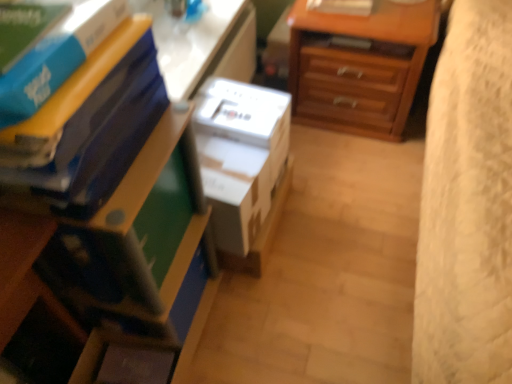
Question: Is white plastic table at upper center further to camera compared to wooden chest of drawers at upper right?

Choices:
 (A) no
 (B) yes

Answer: (A)

Question: Considering the relative positions of white plastic table at upper center and wooden chest of drawers at upper right in the image provided, is white plastic table at upper center to the left of wooden chest of drawers at upper right from the viewer's perspective?

Choices:
 (A) no
 (B) yes

Answer: (B)

Question: Does white plastic table at upper center have a larger size compared to wooden chest of drawers at upper right?

Choices:
 (A) yes
 (B) no

Answer: (B)

Question: Considering the relative sizes of white plastic table at upper center and wooden chest of drawers at upper right in the image provided, is white plastic table at upper center shorter than wooden chest of drawers at upper right?

Choices:
 (A) no
 (B) yes

Answer: (B)

Question: Is white plastic table at upper center to the right of wooden chest of drawers at upper right from the viewer's perspective?

Choices:
 (A) yes
 (B) no

Answer: (B)

Question: From the image's perspective, is white plastic table at upper center above wooden chest of drawers at upper right?

Choices:
 (A) yes
 (B) no

Answer: (B)

Question: Is white plastic table at upper center positioned in front of blue matte book at upper left, the 1th paperback book in the front-to-back sequence?

Choices:
 (A) yes
 (B) no

Answer: (B)

Question: Is white plastic table at upper center far away from blue matte book at upper left, the 1th paperback book in the front-to-back sequence?

Choices:
 (A) no
 (B) yes

Answer: (A)

Question: Considering the relative sizes of white plastic table at upper center and blue matte book at upper left, the 1th paperback book in the front-to-back sequence, in the image provided, is white plastic table at upper center taller than blue matte book at upper left, the 1th paperback book in the front-to-back sequence,?

Choices:
 (A) yes
 (B) no

Answer: (A)

Question: From a real-world perspective, is white plastic table at upper center located beneath blue matte book at upper left, the 1th paperback book in the front-to-back sequence?

Choices:
 (A) yes
 (B) no

Answer: (A)

Question: From the image's perspective, does white plastic table at upper center appear lower than blue matte book at upper left, the 3th paperback book when ordered from back to front?

Choices:
 (A) no
 (B) yes

Answer: (A)

Question: Can we say white plastic table at upper center lies outside blue matte book at upper left, the 1th paperback book in the front-to-back sequence?

Choices:
 (A) yes
 (B) no

Answer: (A)

Question: Is matte plastic nightstand at lower left next to matte blue paperback book at left, which ranks as the second paperback book in front-to-back order?

Choices:
 (A) no
 (B) yes

Answer: (B)